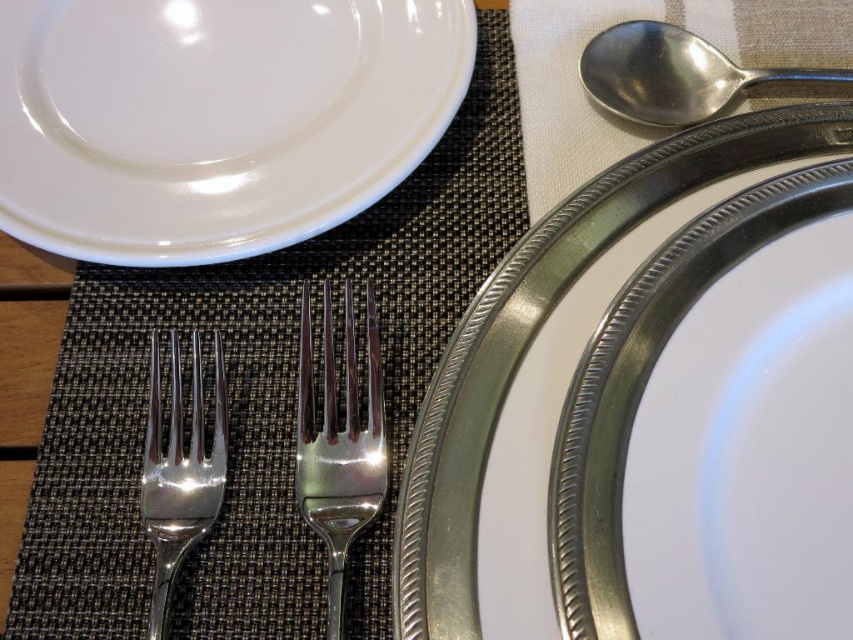
You are setting up a table and need to place a centerpiece at the point indicated by coordinates point (535,333). According to the image, what object is located at this point?

The point (535,333) indicates the location of the metallic silver plate at center.